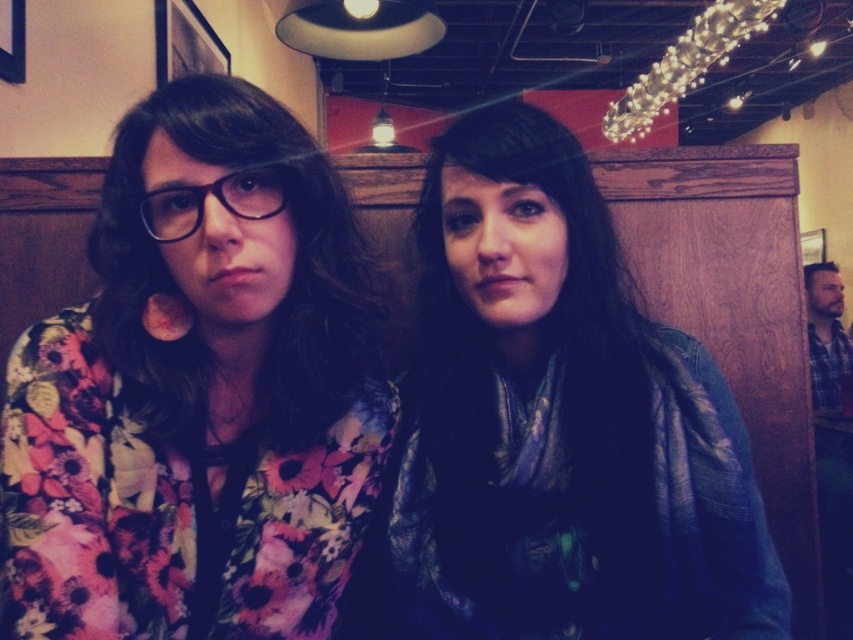
You are a photographer setting up a shot in this scene. You have a camera with a focus range of 10 cm. The shiny blue scarf at center and the matte black glasses at center are both in your view. Can you focus on both objects simultaneously without adjusting your camera settings?

The shiny blue scarf at center is larger in width than the matte black glasses at center. Since both objects are at the same distance from the camera, the camera can focus on both objects simultaneously as long as they are within the focus range. However, the focus range of 10 cm refers to the depth of field, not the size of the objects. If both objects are within the same focal plane, the camera can focus on both.

You are a photographer trying to capture a closeup shot of both the shiny blue scarf at center and the matte black glasses at center. Since you want to focus on the smaller object, which one should you adjust your camera to prioritize?

The matte black glasses at center is smaller than the shiny blue scarf at center, so you should adjust your camera to prioritize focusing on the matte black glasses at center.

Based on the photo, you are a photographer adjusting your camera settings. You notice the floral fabric shirt at left and the matte black glasses at center in your viewfinder. Which object should you focus on first to ensure both are in sharp focus?

The floral fabric shirt at left is closer to the viewer than the matte black glasses at center, so focusing on the floral fabric shirt at left first will ensure both are in sharp focus due to the depth of field.